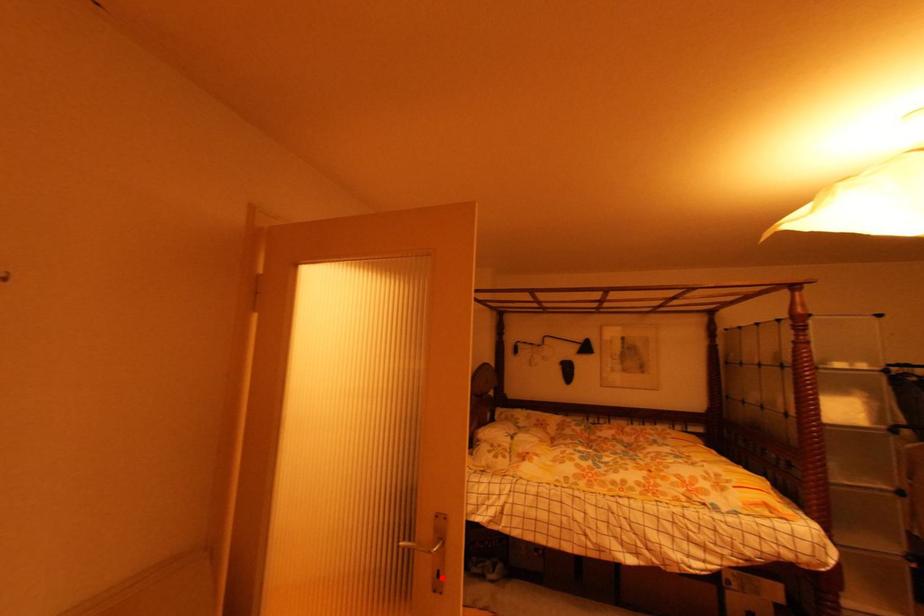
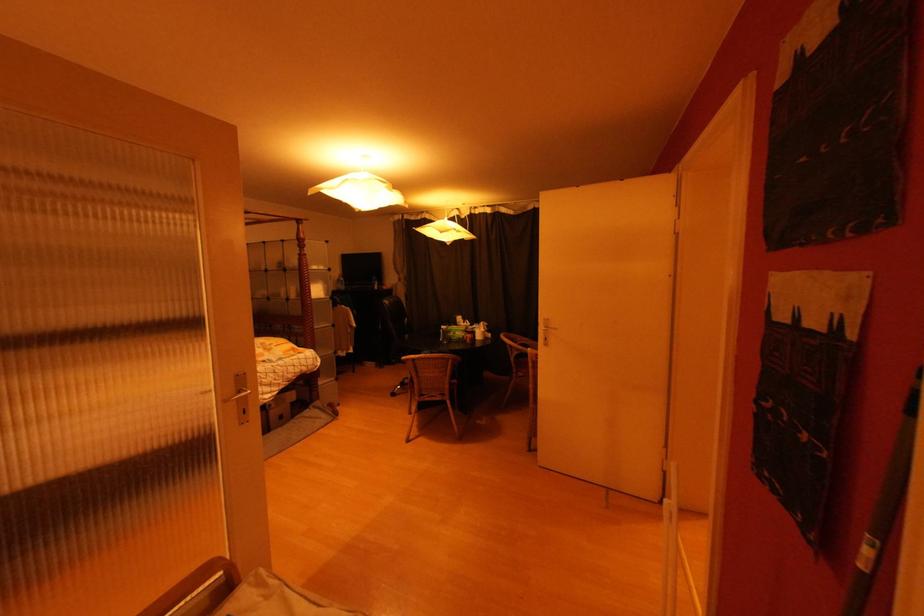
In the second image, find the point that corresponds to the highlighted location in the first image.

(249, 415)